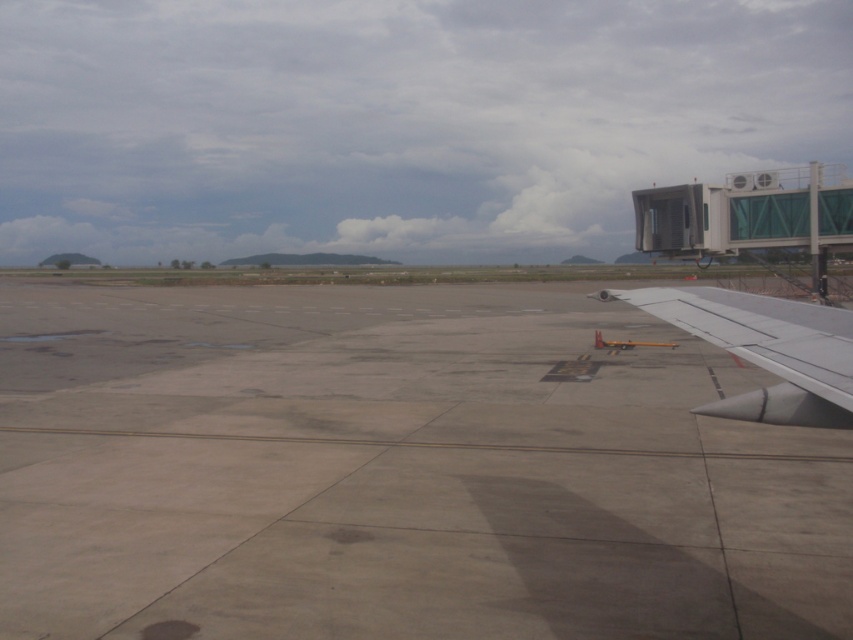
Question: Can you confirm if gray concrete tarmac at center is positioned above silver metallic wing at lower right?

Choices:
 (A) no
 (B) yes

Answer: (A)

Question: Does gray concrete tarmac at center appear on the left side of silver metallic wing at lower right?

Choices:
 (A) no
 (B) yes

Answer: (B)

Question: Does gray concrete tarmac at center appear under silver metallic wing at lower right?

Choices:
 (A) yes
 (B) no

Answer: (A)

Question: Among these points, which one is farthest from the camera?

Choices:
 (A) (44, 531)
 (B) (814, 355)

Answer: (A)

Question: Which point is farther to the camera?

Choices:
 (A) silver metallic wing at lower right
 (B) gray concrete tarmac at center

Answer: (B)